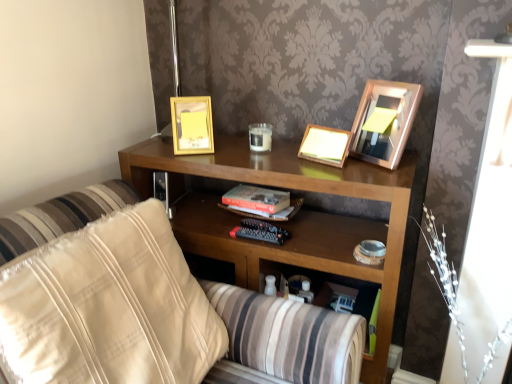
Where is `free spot to the right of gold metallic picture frame at upper center, acting as the third picture frame starting from the right`? Image resolution: width=512 pixels, height=384 pixels. free spot to the right of gold metallic picture frame at upper center, acting as the third picture frame starting from the right is located at coordinates (228, 148).